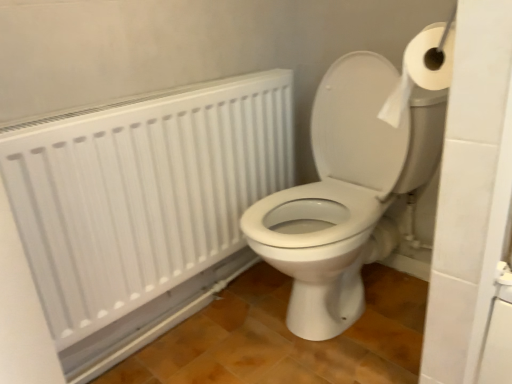
Find the location of a particular element. This screenshot has width=512, height=384. white paper at upper right is located at coordinates (422, 69).

Considering the relative sizes of white glossy toilet at center and white matte radiator at upper left in the image provided, is white glossy toilet at center thinner than white matte radiator at upper left?

No.

Can you tell me how much white glossy toilet at center and white matte radiator at upper left differ in facing direction?

The facing directions of white glossy toilet at center and white matte radiator at upper left are 91.6 degrees apart.

Which is behind, white glossy toilet at center or white matte radiator at upper left?

white matte radiator at upper left is further away from the camera.

Between white glossy toilet at center and white matte radiator at upper left, which one has less height?

white matte radiator at upper left.

Is white paper at upper right inside the boundaries of white glossy toilet at center, or outside?

The correct answer is: outside.

Can you confirm if white paper at upper right is thinner than white glossy toilet at center?

Indeed, white paper at upper right has a lesser width compared to white glossy toilet at center.

Would you consider white paper at upper right to be distant from white glossy toilet at center?

No, white paper at upper right is not far away from white glossy toilet at center.

Considering the relative positions of white paper at upper right and white glossy toilet at center in the image provided, is white paper at upper right to the left of white glossy toilet at center from the viewer's perspective?

No, white paper at upper right is not to the left of white glossy toilet at center.

From a real-world perspective, between white paper at upper right and white matte radiator at upper left, who is vertically lower?

white matte radiator at upper left is physically lower.

Can you confirm if white paper at upper right is bigger than white matte radiator at upper left?

No.

Is point (419, 33) closer to camera compared to point (89, 218)?

Yes, point (419, 33) is in front of point (89, 218).

Between white paper at upper right and white matte radiator at upper left, which one has more height?

Standing taller between the two is white matte radiator at upper left.

Is white matte radiator at upper left turned away from white paper at upper right?

No, white matte radiator at upper left's orientation is not away from white paper at upper right.

Is point (53, 197) positioned before point (429, 45)?

No.

In terms of height, does white matte radiator at upper left look taller or shorter compared to white paper at upper right?

Clearly, white matte radiator at upper left is taller compared to white paper at upper right.

You are a GUI agent. You are given a task and a screenshot of the screen. Output one action in this format:
    pyautogui.click(x=<x>, y=<y>)
    Task: Click on the radiator on the left of white paper at upper right
    
    Given the screenshot: What is the action you would take?
    pyautogui.click(x=143, y=192)

Is white matte radiator at upper left oriented towards white glossy toilet at center?

Yes, white matte radiator at upper left is aimed at white glossy toilet at center.

Considering the relative positions of white matte radiator at upper left and white glossy toilet at center in the image provided, is white matte radiator at upper left in front of white glossy toilet at center?

No.

Considering the sizes of white matte radiator at upper left and white glossy toilet at center in the image, is white matte radiator at upper left wider or thinner than white glossy toilet at center?

Considering their sizes, white matte radiator at upper left looks slimmer than white glossy toilet at center.

Based on the photo, how many degrees apart are the facing directions of white glossy toilet at center and white paper at upper right?

The angle between the facing direction of white glossy toilet at center and the facing direction of white paper at upper right is 92.6 degrees.

Considering the positions of objects white glossy toilet at center and white paper at upper right in the image provided, who is more to the right, white glossy toilet at center or white paper at upper right?

Positioned to the right is white paper at upper right.

Is white glossy toilet at center situated inside white paper at upper right or outside?

white glossy toilet at center is not inside white paper at upper right, it's outside.

Is white glossy toilet at center in contact with white paper at upper right?

white glossy toilet at center and white paper at upper right are clearly separated.

Locate an element on the screen. This screenshot has width=512, height=384. radiator that is above the white glossy toilet at center (from a real-world perspective) is located at coordinates (143, 192).

In the image, there is a white glossy toilet at center. Identify the location of toilet paper above it (from the image's perspective). (422, 69).

When comparing their distances from white matte radiator at upper left, does white glossy toilet at center or white paper at upper right seem further?

white paper at upper right is positioned further to the anchor white matte radiator at upper left.

From the image, which object appears to be nearer to white matte radiator at upper left, white paper at upper right or white glossy toilet at center?

white glossy toilet at center is closer to white matte radiator at upper left.

Based on their spatial positions, is white matte radiator at upper left or white glossy toilet at center closer to white paper at upper right?

white glossy toilet at center is closer to white paper at upper right.

When comparing their distances from white glossy toilet at center, does white matte radiator at upper left or white paper at upper right seem further?

white paper at upper right.

Looking at the image, which one is located closer to white paper at upper right, white glossy toilet at center or white matte radiator at upper left?

white glossy toilet at center is positioned closer to the anchor white paper at upper right.

In the scene shown: Based on their spatial positions, is white paper at upper right or white matte radiator at upper left further from white glossy toilet at center?

The object further to white glossy toilet at center is white paper at upper right.

I want to click on toilet between white matte radiator at upper left and white paper at upper right, so [x=345, y=193].